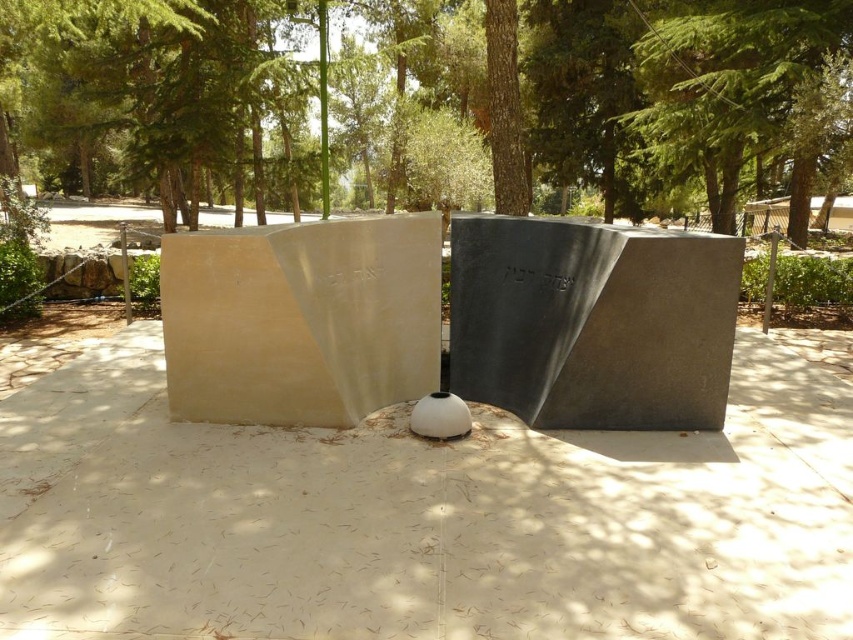
You are a landscape architect designing a pathway between the beige concrete at center and the black polished stone at center. Given their widths, which monument will require a wider path to accommodate its size?

The beige concrete at center requires a wider path since its width is larger than the black polished stone at center.

You are planning to install a new bench in the area between the green leafy tree at center and the black polished stone at center. Considering their heights, which object might cast a longer shadow at noon? Please refer to the scene description for context.

The green leafy tree at center has a greater height compared to the black polished stone at center, so it will cast a longer shadow at noon.